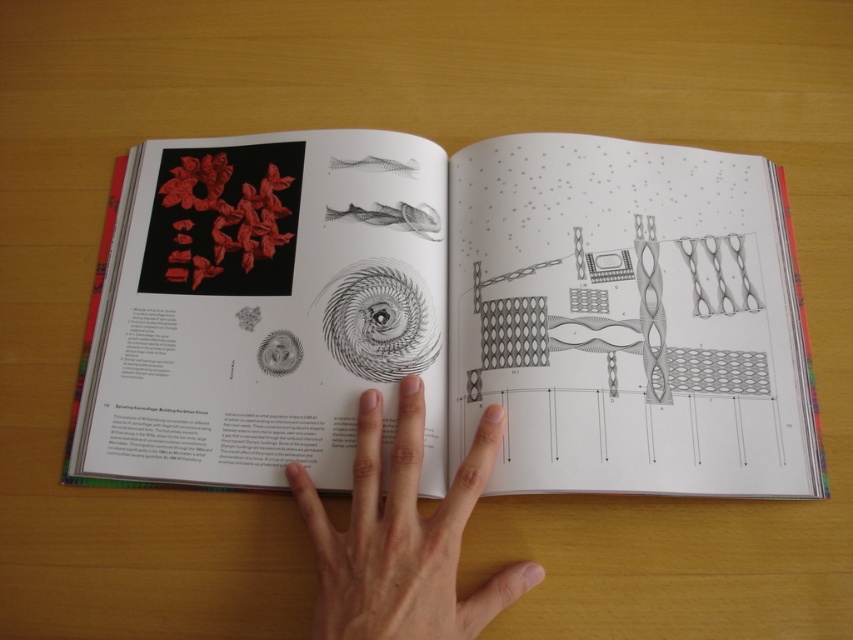
You are an artist who wants to place a new sketch between the matte black book at center and the skinny flesh at center. Based on their positions, which object should you place the sketch closer to?

The matte black book at center is to the right of the skinny flesh at center. Therefore, to place the sketch between them, you should position it closer to the matte black book at center since it is on the right side of the skinny flesh at center.

You are a photographer setting up for a product shoot. Your camera is positioned at a certain distance from the matte black book at center. If you need to ensure the book is in focus at a focal length of 50mm, what is the minimum distance you should maintain between the camera and the book to achieve sharp focus?

The matte black book at center is 24.28 inches away from the camera. To ensure sharp focus at 50mm focal length, the minimum distance should be at least 24.28 inches, which is the current distance provided.

You are an artist who wants to place a matte black book at center and a skinny flesh at center on an 8.5 inch wide shelf. Can both items fit side by side without overlapping?

The matte black book at center is wider than the skinny flesh at center. Since the shelf is 8.5 inches wide, we need to know the combined width of both items. However, the exact widths aren